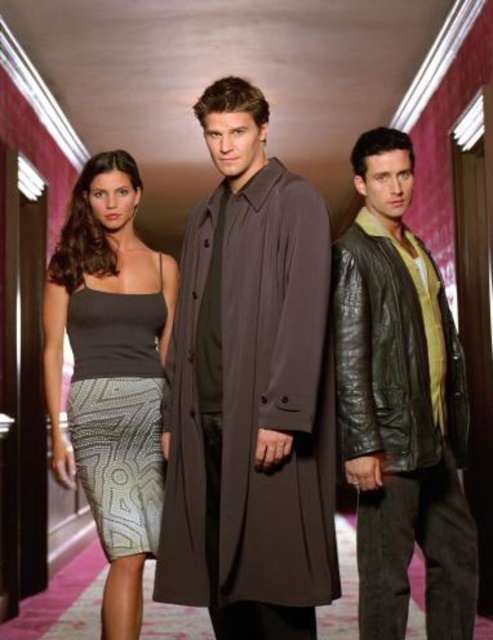
In the scene shown: Can you confirm if leather jacket at center is positioned to the left of knit fabric tank top at center?

Incorrect, leather jacket at center is not on the left side of knit fabric tank top at center.

How distant is leather jacket at center from knit fabric tank top at center?

They are 3.55 feet apart.

Identify the location of leather jacket at center. This screenshot has height=640, width=493. (400, 404).

Identify the location of leather jacket at center. The image size is (493, 640). (400, 404).

Which is in front, point (465, 392) or point (103, 426)?

Point (465, 392) is in front.

Can you confirm if leather jacket at center is bigger than gray textured dress at left?

Yes.

Is point (345, 428) positioned after point (140, 337)?

No, it is in front of (140, 337).

This screenshot has height=640, width=493. Identify the location of leather jacket at center. 400,404.

Does knit fabric tank top at center appear under gray textured dress at left?

No, knit fabric tank top at center is not below gray textured dress at left.

Does knit fabric tank top at center appear on the left side of gray textured dress at left?

Correct, you'll find knit fabric tank top at center to the left of gray textured dress at left.

The image size is (493, 640). I want to click on knit fabric tank top at center, so click(110, 372).